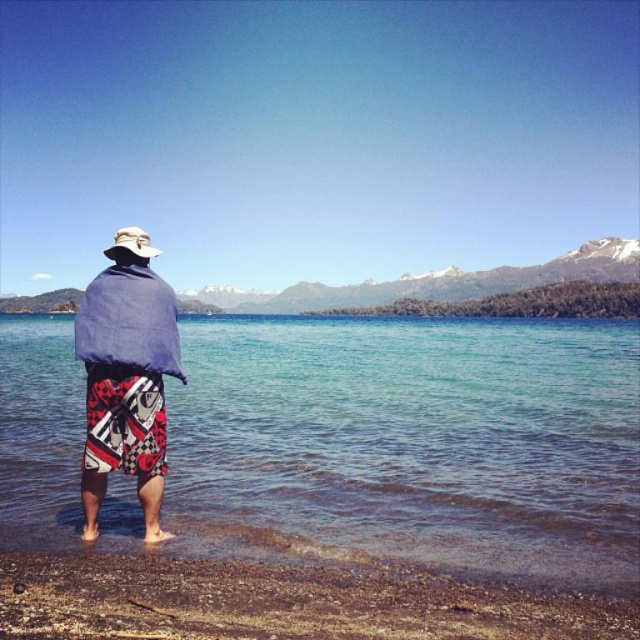
You are standing at the edge of the lake and want to step into the water. Based on the coordinates provided, where exactly is the clear water at lower center located?

The clear water at lower center is located at point coordinates (410, 442).

You are a photographer trying to capture the snowy rock mountain at upper center and the white fabric hat at upper center in the same frame. Based on their sizes, which object would appear larger in your photo?

The snowy rock mountain at upper center would appear larger in the photo since it is taller than the white fabric hat at upper center.